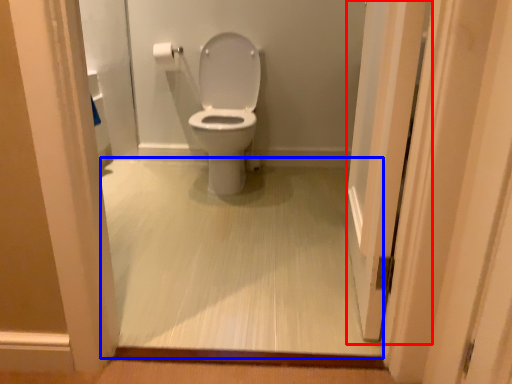
Question: Which object is further to the camera taking this photo, screen door (highlighted by a red box) or corridor (highlighted by a blue box)?

Choices:
 (A) screen door
 (B) corridor

Answer: (B)